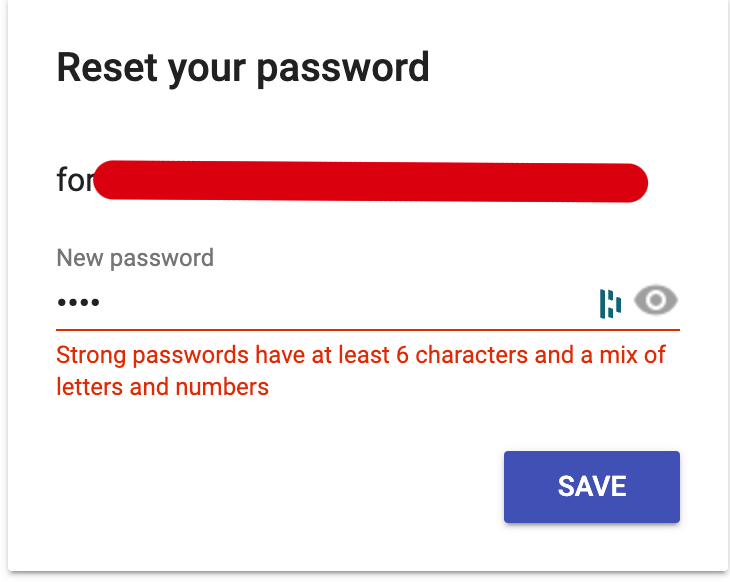
Where is `screen`? screen is located at coordinates (461, 88).